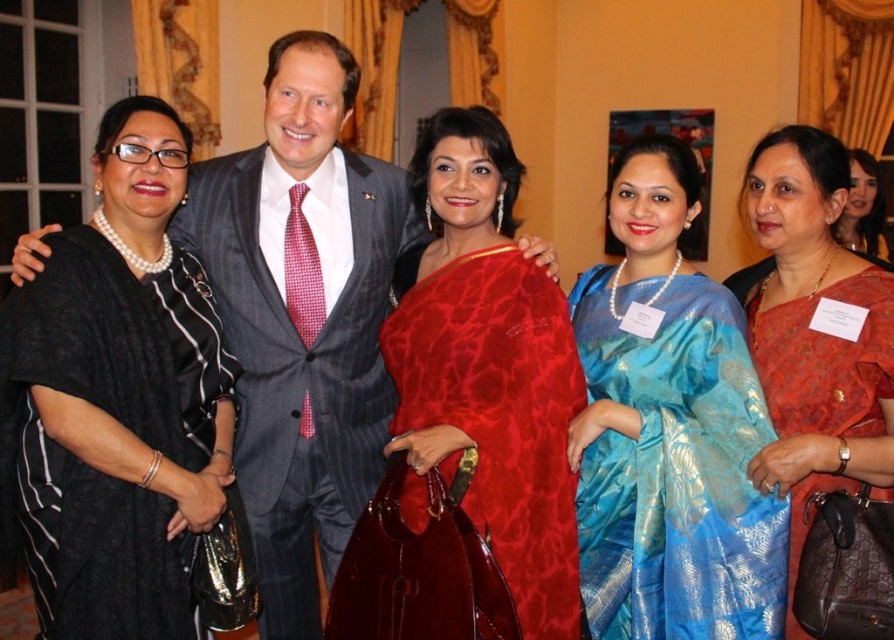
Question: Which object appears farthest from the camera in this image?

Choices:
 (A) matte red sari at center
 (B) black silk dress at left

Answer: (A)

Question: Where is blue silk saree at center located in relation to matte red sari at center in the image?

Choices:
 (A) left
 (B) right

Answer: (A)

Question: Is blue silk saree at center bigger than matte red sari at center?

Choices:
 (A) no
 (B) yes

Answer: (B)

Question: Does red silk saree at center have a larger size compared to matte red sari at center?

Choices:
 (A) yes
 (B) no

Answer: (A)

Question: Which point is farther to the camera?

Choices:
 (A) (721, 429)
 (B) (554, 564)
 (C) (146, 368)
 (D) (23, 253)

Answer: (B)

Question: Which object is the closest to the blue silk saree at center?

Choices:
 (A) matte red sari at center
 (B) matte gray suit at center
 (C) black silk dress at left

Answer: (A)